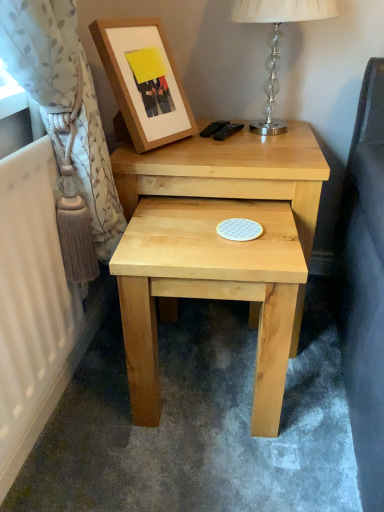
Question: Does natural wood stool at center contain natural wood nightstand at center?

Choices:
 (A) no
 (B) yes

Answer: (A)

Question: Is natural wood stool at center outside of natural wood nightstand at center?

Choices:
 (A) no
 (B) yes

Answer: (B)

Question: From the image's perspective, would you say natural wood stool at center is shown under natural wood nightstand at center?

Choices:
 (A) no
 (B) yes

Answer: (B)

Question: From a real-world perspective, is natural wood stool at center beneath natural wood nightstand at center?

Choices:
 (A) yes
 (B) no

Answer: (A)

Question: Does natural wood stool at center have a lesser width compared to natural wood nightstand at center?

Choices:
 (A) no
 (B) yes

Answer: (B)

Question: Visually, is natural wood stool at center positioned to the left or to the right of wooden picture frame at upper left?

Choices:
 (A) left
 (B) right

Answer: (B)

Question: Considering the positions of point (294, 229) and point (170, 116), is point (294, 229) closer or farther from the camera than point (170, 116)?

Choices:
 (A) closer
 (B) farther

Answer: (A)

Question: Is natural wood stool at center spatially inside wooden picture frame at upper left, or outside of it?

Choices:
 (A) outside
 (B) inside

Answer: (A)

Question: In the image, is natural wood stool at center positioned in front of or behind wooden picture frame at upper left?

Choices:
 (A) behind
 (B) front

Answer: (B)

Question: Relative to natural wood nightstand at center, is wooden picture frame at upper left in front or behind?

Choices:
 (A) front
 (B) behind

Answer: (A)

Question: Is point (117, 54) closer or farther from the camera than point (195, 144)?

Choices:
 (A) closer
 (B) farther

Answer: (A)

Question: From their relative heights in the image, would you say wooden picture frame at upper left is taller or shorter than natural wood nightstand at center?

Choices:
 (A) tall
 (B) short

Answer: (B)

Question: From the image's perspective, is wooden picture frame at upper left positioned above or below natural wood nightstand at center?

Choices:
 (A) below
 (B) above

Answer: (B)

Question: Is natural wood nightstand at center bigger or smaller than light beige floral fabric curtain at left?

Choices:
 (A) small
 (B) big

Answer: (B)

Question: Does point (195, 160) appear closer or farther from the camera than point (29, 80)?

Choices:
 (A) closer
 (B) farther

Answer: (B)